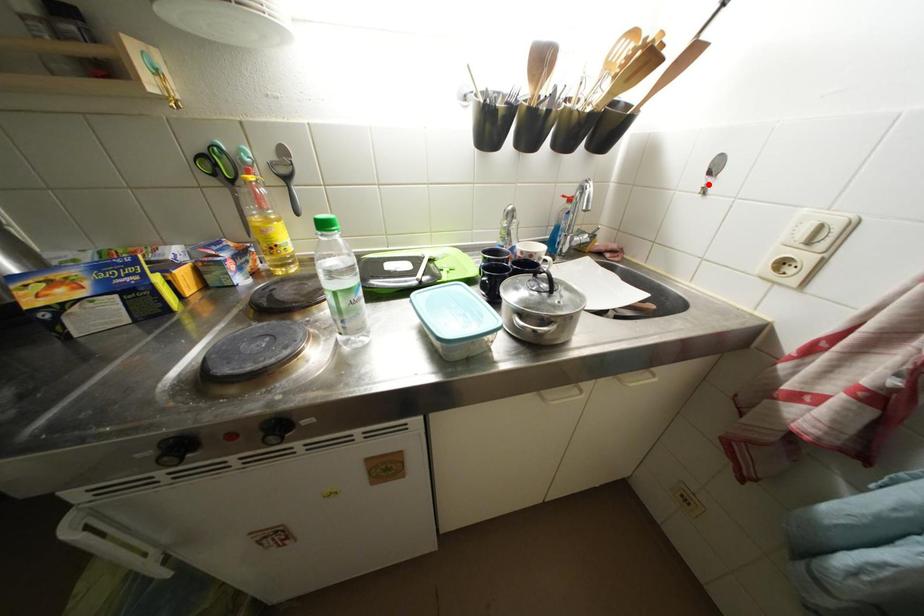
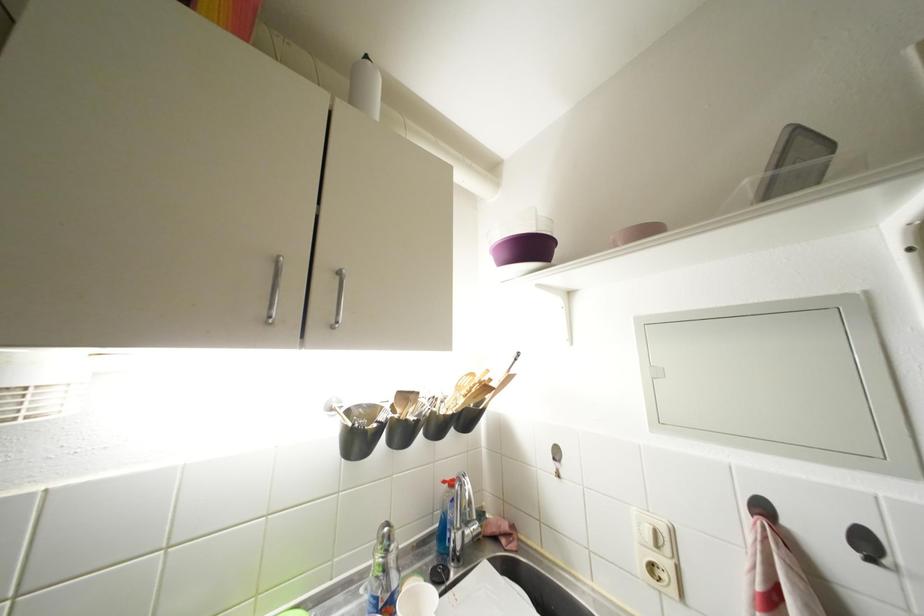
Where in the second image is the point corresponding to the highlighted location from the first image?

(560, 469)